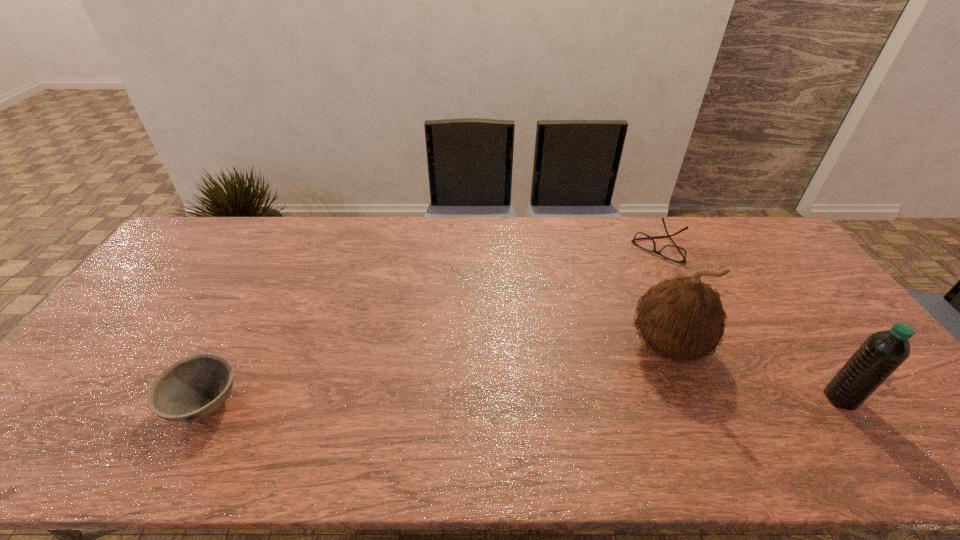
Find the location of a particular element. blank space at the far edge of the desktop is located at coordinates point(302,224).

Locate an element on the screen. vacant region at the near edge of the desktop is located at coordinates (374, 420).

This screenshot has width=960, height=540. In order to click on free space at the left edge in this screenshot , I will do `click(147, 306)`.

Where is `vacant space at the right edge of the desktop`? vacant space at the right edge of the desktop is located at coordinates (801, 294).

Image resolution: width=960 pixels, height=540 pixels. What are the coordinates of `vacant space at the far left corner of the desktop` in the screenshot? It's located at (217, 219).

The height and width of the screenshot is (540, 960). Identify the location of vacant area at the far right corner of the desktop. (734, 227).

The image size is (960, 540). What are the coordinates of `unoccupied position between the second shortest object and the tallest object` in the screenshot? It's located at (438, 375).

You are a GUI agent. You are given a task and a screenshot of the screen. Output one action in this format:
    pyautogui.click(x=<x>, y=<y>)
    Task: Click on the free spot between the rightmost object and the coconut
    The image size is (960, 540).
    Given the screenshot: What is the action you would take?
    pyautogui.click(x=755, y=373)

Image resolution: width=960 pixels, height=540 pixels. Identify the location of unoccupied position between the water bottle and the coconut. (755, 373).

Locate an element on the screen. The width and height of the screenshot is (960, 540). free area in between the second tallest object and the farthest object is located at coordinates (751, 322).